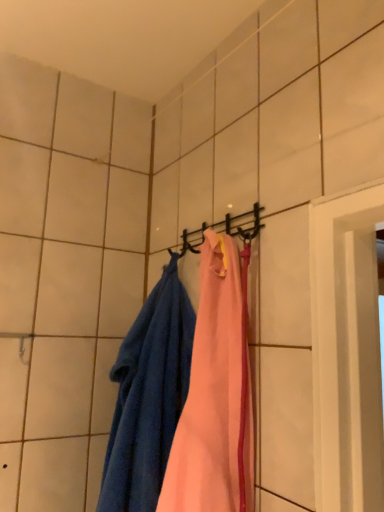
Question: Is blue terry cloth towel at left spatially inside metallic black hanger at center, or outside of it?

Choices:
 (A) inside
 (B) outside

Answer: (B)

Question: Is point (127, 461) positioned closer to the camera than point (248, 232)?

Choices:
 (A) farther
 (B) closer

Answer: (A)

Question: Based on their sizes in the image, would you say blue terry cloth towel at left is bigger or smaller than metallic black hanger at center?

Choices:
 (A) big
 (B) small

Answer: (A)

Question: Considering the positions of point (238, 230) and point (110, 477), is point (238, 230) closer or farther from the camera than point (110, 477)?

Choices:
 (A) closer
 (B) farther

Answer: (A)

Question: Considering the positions of metallic black hanger at center and blue terry cloth towel at left in the image, is metallic black hanger at center wider or thinner than blue terry cloth towel at left?

Choices:
 (A) wide
 (B) thin

Answer: (B)

Question: Would you say metallic black hanger at center is to the left or to the right of blue terry cloth towel at left in the picture?

Choices:
 (A) right
 (B) left

Answer: (A)

Question: From their relative heights in the image, would you say metallic black hanger at center is taller or shorter than blue terry cloth towel at left?

Choices:
 (A) tall
 (B) short

Answer: (B)